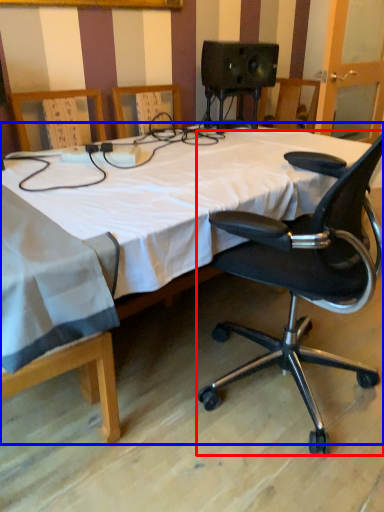
Question: Which object is further to the camera taking this photo, chair (highlighted by a red box) or bed (highlighted by a blue box)?

Choices:
 (A) chair
 (B) bed

Answer: (A)